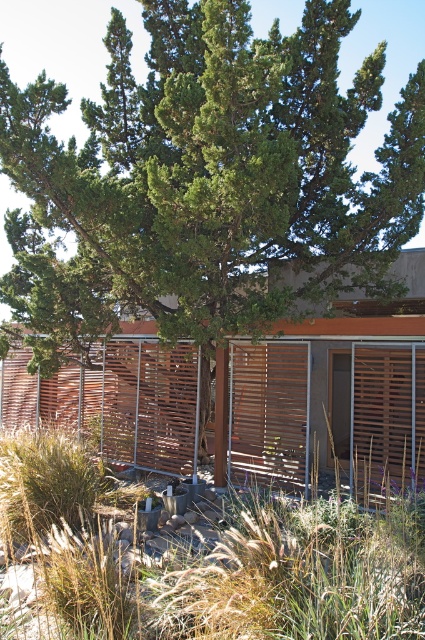
You are a landscape architect designing a garden. You have two elements in the scene, the dry grass at center and the wooden slats at center. Which of these two elements is bigger in size?

The dry grass at center has a larger size compared to wooden slats at center, so the dry grass at center is bigger in size.

You are a landscape architect designing a pathway between the dry grass at center and the wooden slats at center. Which side should the pathway be placed on to accommodate the wider area?

The pathway should be placed on the side of the dry grass at center since it is wider than the wooden slats at center.

You are standing in front of the modern building and notice dry grass at center and wooden slats at center. Which object is nearer to you?

The dry grass at center is closer to the viewer than the wooden slats at center.